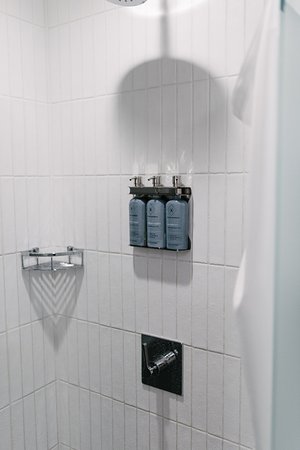
Image resolution: width=300 pixels, height=450 pixels. I want to click on shower head, so click(x=131, y=2).